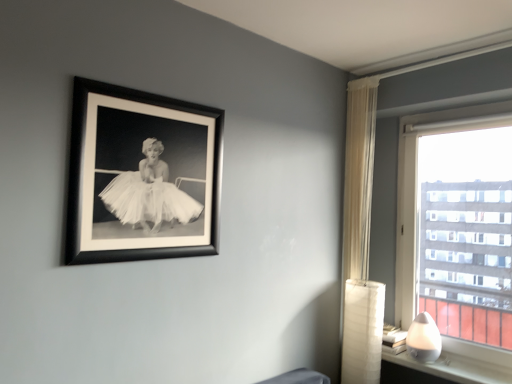
Question: Based on their sizes in the image, would you say sheer white curtain at right is bigger or smaller than white glossy table lamp at lower right?

Choices:
 (A) small
 (B) big

Answer: (B)

Question: Considering their positions, is sheer white curtain at right located in front of or behind white glossy table lamp at lower right?

Choices:
 (A) behind
 (B) front

Answer: (A)

Question: Which object is positioned farthest from the sheer white curtain at right?

Choices:
 (A) white glossy table lamp at lower right
 (B) white glossy lamp at lower right
 (C) transparent glass window at right
 (D) black matte picture frame at upper left

Answer: (D)

Question: Which object is positioned farthest from the white glossy lamp at lower right?

Choices:
 (A) sheer white curtain at right
 (B) transparent glass window at right
 (C) white glossy table lamp at lower right
 (D) black matte picture frame at upper left

Answer: (D)